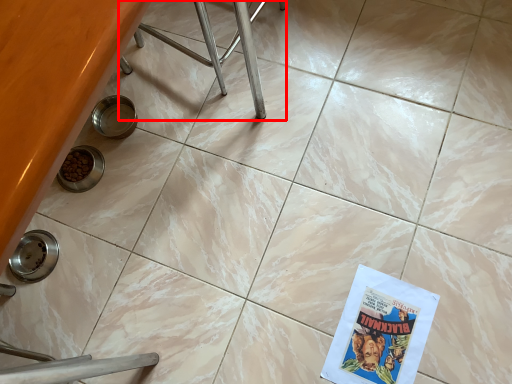
Question: From the image's perspective, what is the correct spatial positioning of furniture (annotated by the red box) in reference to comic book?

Choices:
 (A) above
 (B) below

Answer: (A)